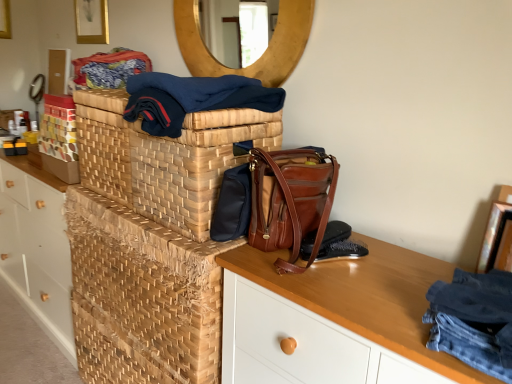
Identify the location of free space in front of brown leather shoe at center, the second shoe in the top-to-bottom sequence. (349, 289).